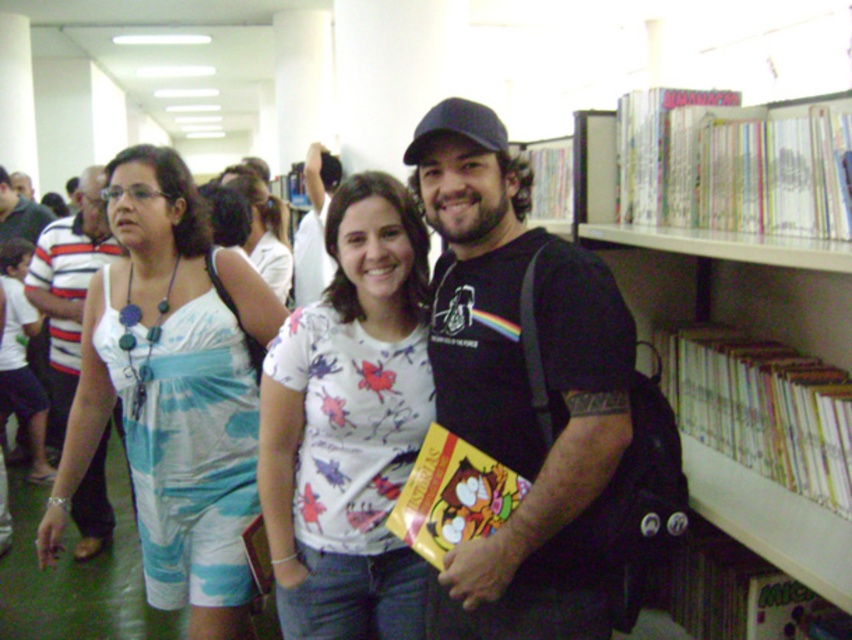
Is white cotton shirt at center positioned before striped cotton shirt at left?

That is True.

Which is more to the right, white cotton shirt at center or striped cotton shirt at left?

white cotton shirt at center is more to the right.

Is point (459, 227) more distant than point (90, 529)?

No, (459, 227) is closer to viewer.

Locate an element on the screen. The width and height of the screenshot is (852, 640). white cotton shirt at center is located at coordinates (538, 536).

Does striped cotton shirt at left have a lesser height compared to hardcover book at upper right?

No.

Does striped cotton shirt at left appear on the right side of hardcover book at upper right?

No, striped cotton shirt at left is not to the right of hardcover book at upper right.

You are a GUI agent. You are given a task and a screenshot of the screen. Output one action in this format:
    pyautogui.click(x=<x>, y=<y>)
    Task: Click on the striped cotton shirt at left
    Image resolution: width=852 pixels, height=640 pixels.
    Given the screenshot: What is the action you would take?
    pyautogui.click(x=68, y=285)

Based on the photo, which is below, white printed shirt at center or hardcover book at upper right?

Positioned lower is white printed shirt at center.

Where is `white printed shirt at center`? The image size is (852, 640). white printed shirt at center is located at coordinates (349, 426).

This screenshot has width=852, height=640. In order to click on white printed shirt at center in this screenshot , I will do `click(349, 426)`.

This screenshot has height=640, width=852. I want to click on white printed shirt at center, so click(349, 426).